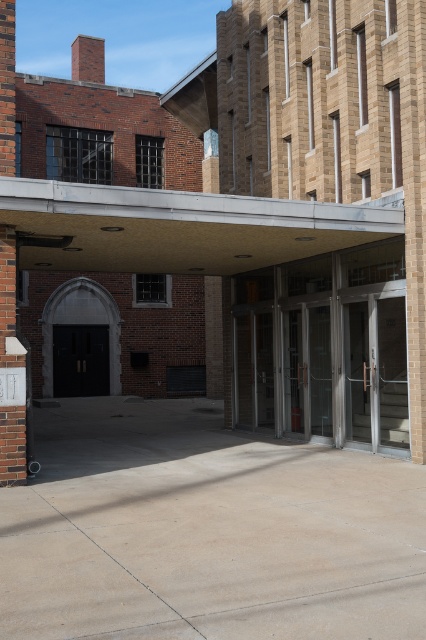
What do you see at coordinates (11, 369) in the screenshot? I see `brick pillar at left` at bounding box center [11, 369].

Find the location of a particular element. The height and width of the screenshot is (640, 426). brick pillar at left is located at coordinates (11, 369).

Where is `brick pillar at left`? The image size is (426, 640). brick pillar at left is located at coordinates (11, 369).